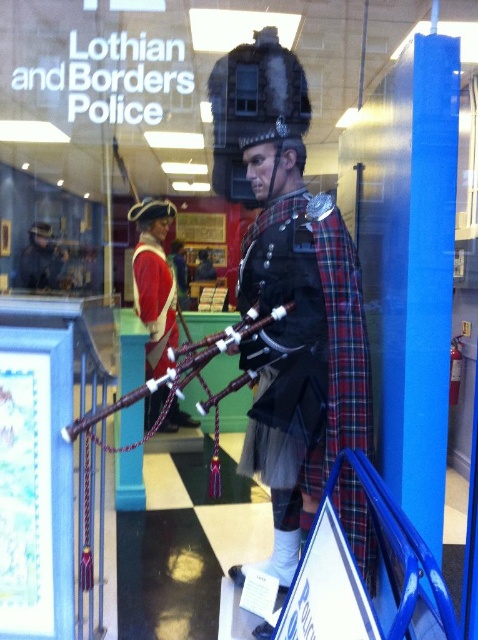
Does matte black kilt at center come in front of red wool uniform at center?

Yes.

Does matte black kilt at center lie behind red wool uniform at center?

No, matte black kilt at center is closer to the viewer.

Is point (290, 141) farther from viewer compared to point (173, 305)?

No, (290, 141) is in front of (173, 305).

Find the location of a particular element. Image resolution: width=478 pixels, height=640 pixels. matte black kilt at center is located at coordinates (291, 288).

Find the location of a particular element. matte black kilt at center is located at coordinates (291, 288).

Is point (304, 102) closer to viewer compared to point (99, 417)?

No.

Between point (260, 77) and point (194, 365), which one is positioned in front?

Point (194, 365) is in front.

What are the coordinates of `matte black kilt at center` in the screenshot? It's located at (291, 288).

Can you confirm if red wool uniform at center is bigger than wooden pipes at center?

Yes, red wool uniform at center is bigger than wooden pipes at center.

You are a GUI agent. You are given a task and a screenshot of the screen. Output one action in this format:
    pyautogui.click(x=<x>, y=<y>)
    Task: Click on the red wool uniform at center
    Image resolution: width=478 pixels, height=640 pixels.
    Given the screenshot: What is the action you would take?
    pyautogui.click(x=154, y=282)

Locate an element on the screen. This screenshot has height=640, width=478. red wool uniform at center is located at coordinates (154, 282).